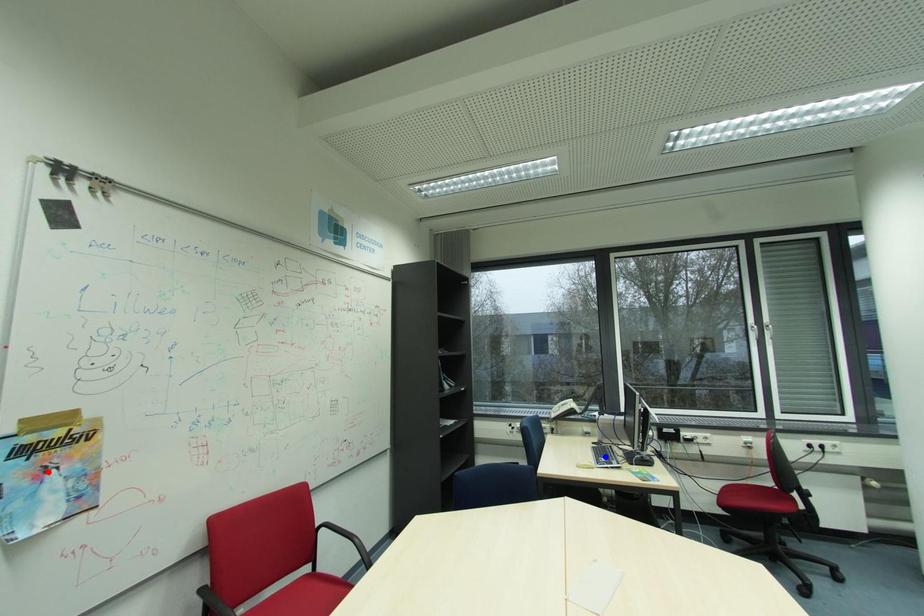
Question: Two points are marked on the image. Which point is closer to the camera?

Choices:
 (A) Blue point is closer.
 (B) Red point is closer.

Answer: (B)